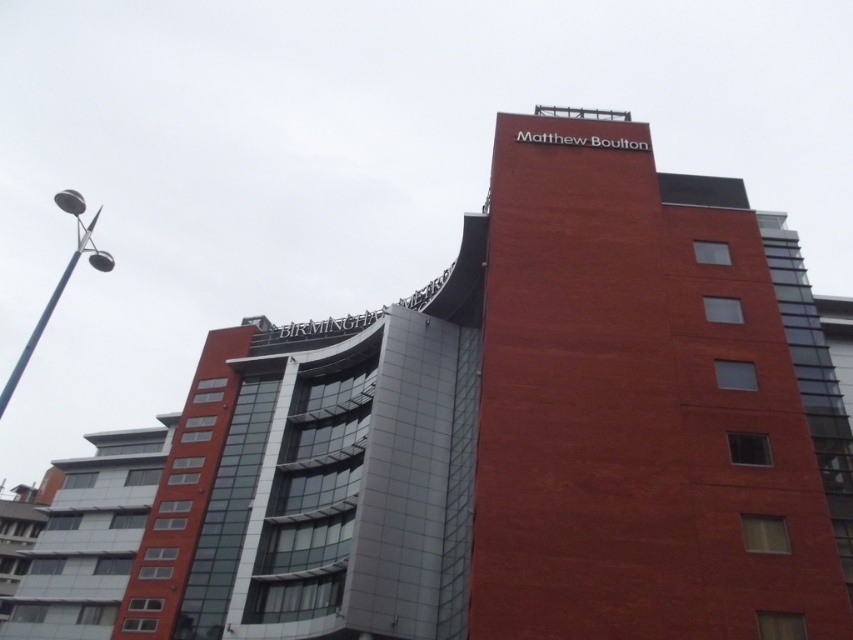
You are standing in front of the modern building and notice a black metal pole at upper left and a red brick building at center. Which object is positioned to the right of the other?

The red brick building at center is positioned to the right of the black metal pole at upper left.

You are a city planner reviewing a new building design. The red brick building at center and the black metal pole at upper left are part of the proposed structure. Based on the design, which object takes up more area in the image?

The black metal pole at upper left takes up more area in the image than the red brick building at center, as the red brick building at center occupies less space than black metal pole at upper left.